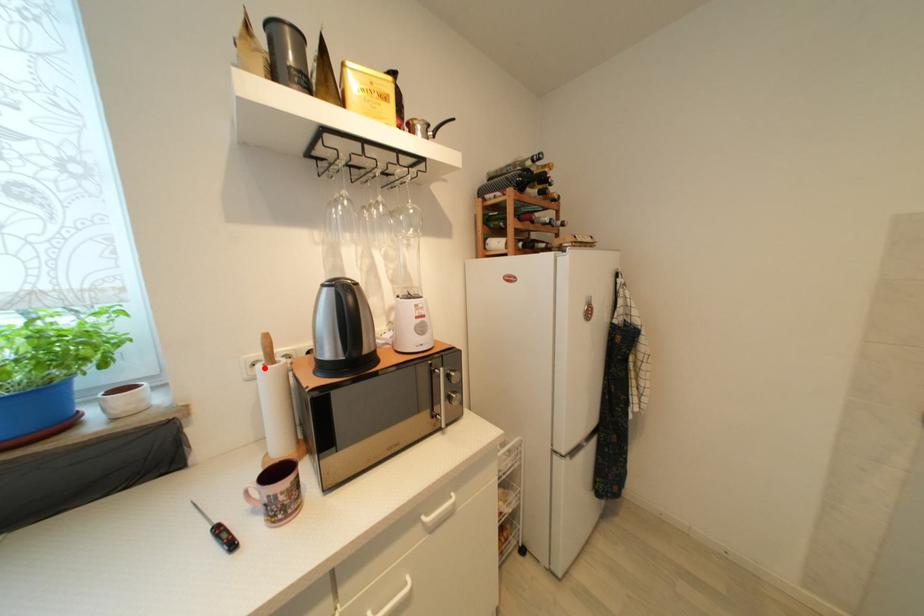
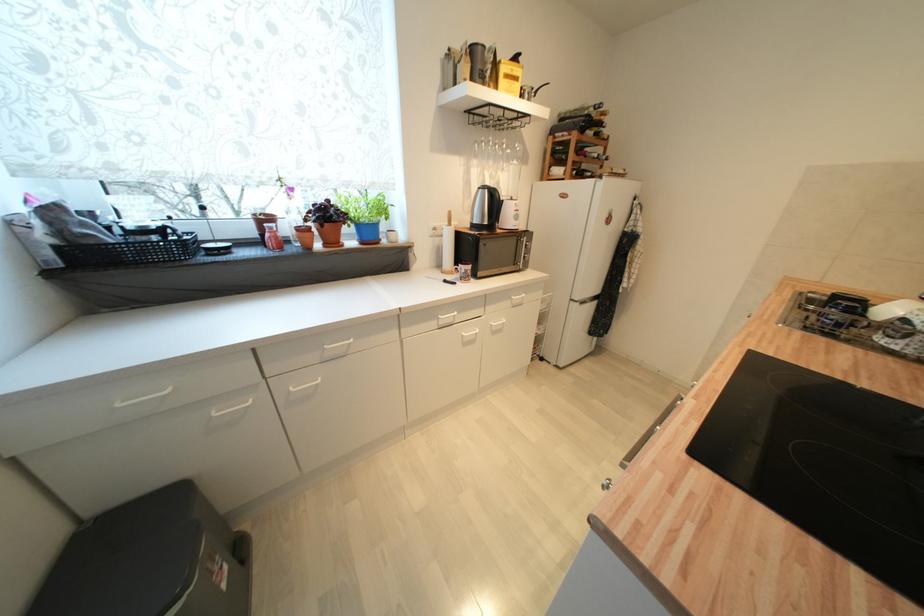
The point at the highlighted location is marked in the first image. Where is the corresponding point in the second image?

(450, 229)